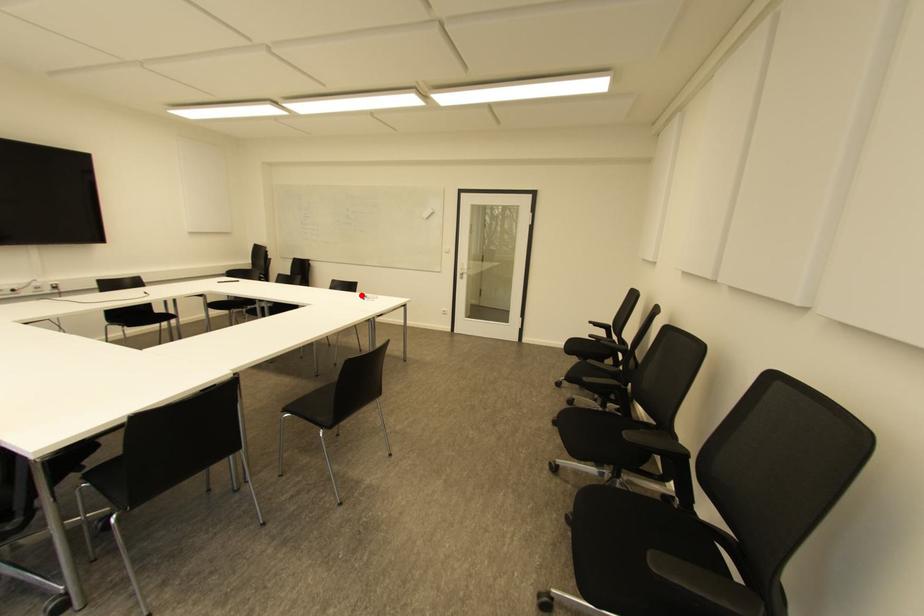
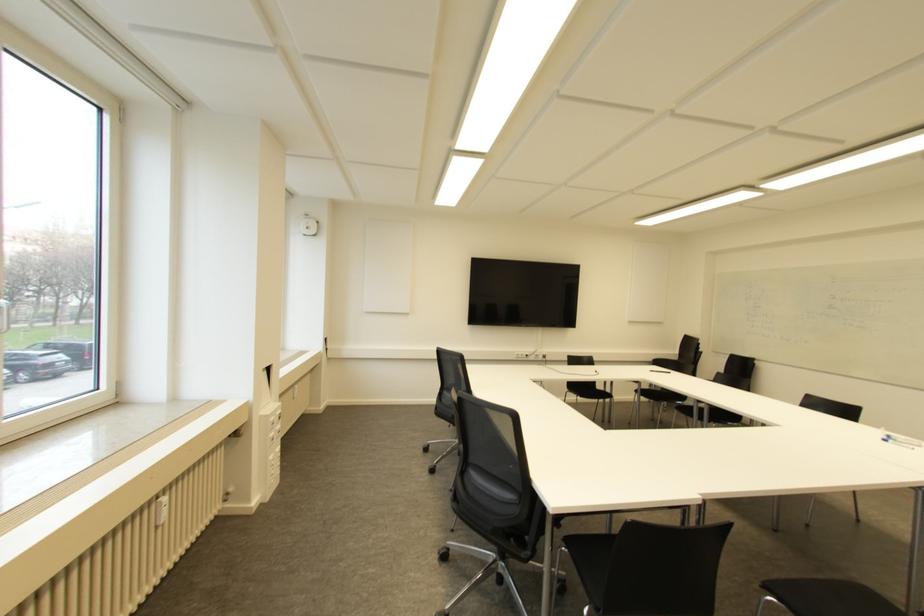
Find the pixel in the second image that matches the highlighted location in the first image.

(880, 434)